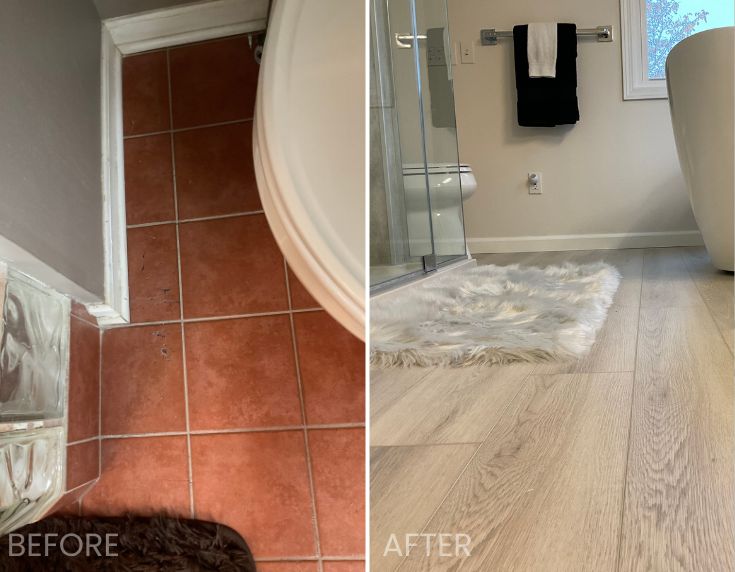
Locate an element on the screen. This screenshot has height=572, width=735. toilet lid is located at coordinates (340, 81), (430, 165).